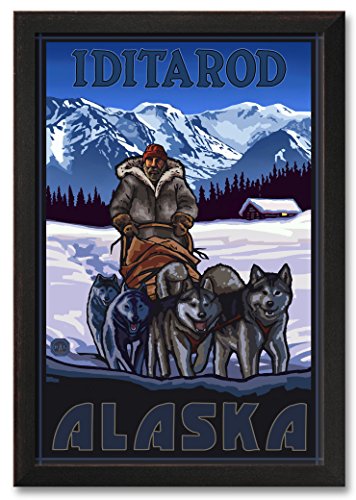
Locate an element on the screen. The height and width of the screenshot is (500, 356). coat is located at coordinates (165, 199).